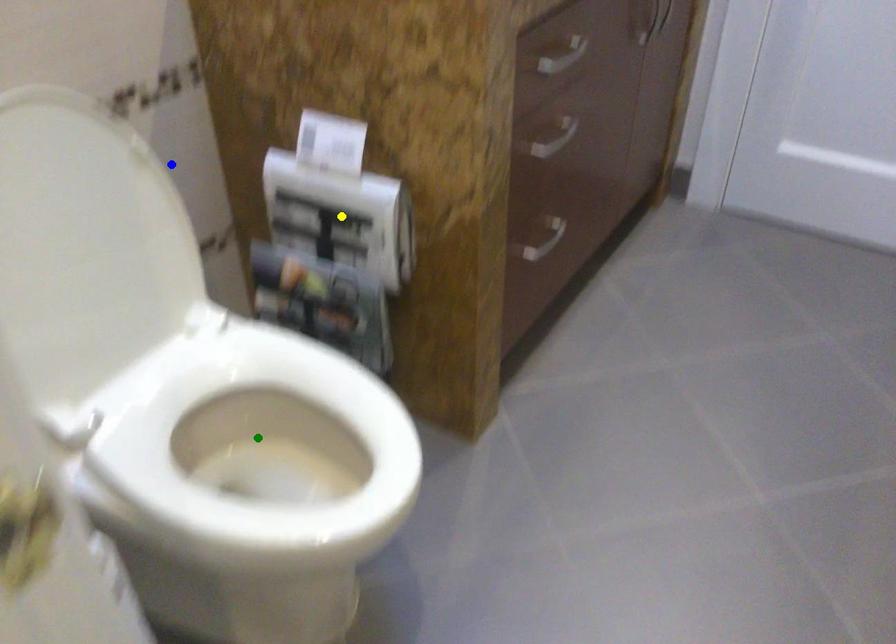
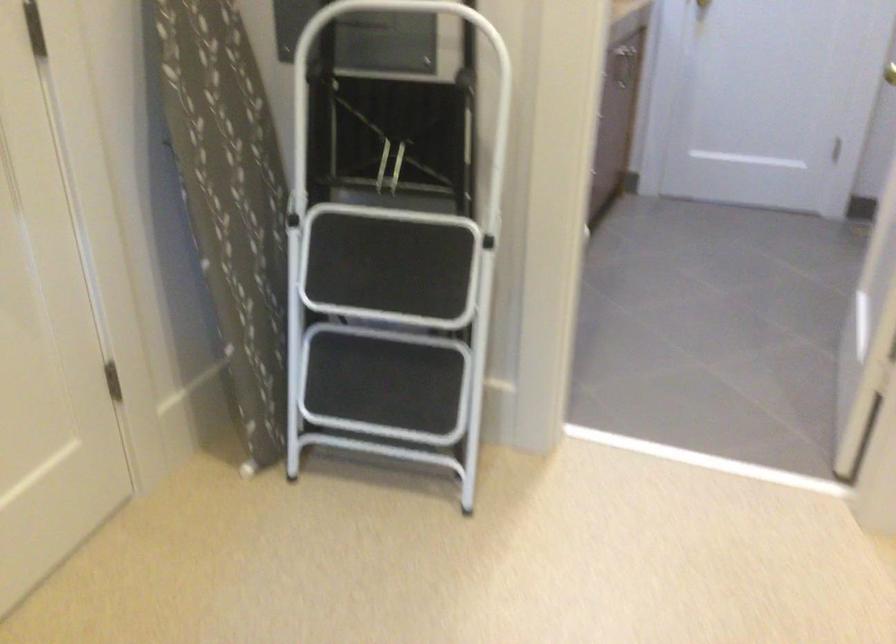
I am providing you with two images of the same scene from different viewpoints. Three points are marked in image1. Which point corresponds to a part or object that is occluded in image2?In image1, three points are marked. Which of them correspond to a part or object that is occluded in image2?Among the three points shown in image1, which one corresponds to a part or object that is no longer visible due to occlusion in image2?

blue point, green point, yellow point